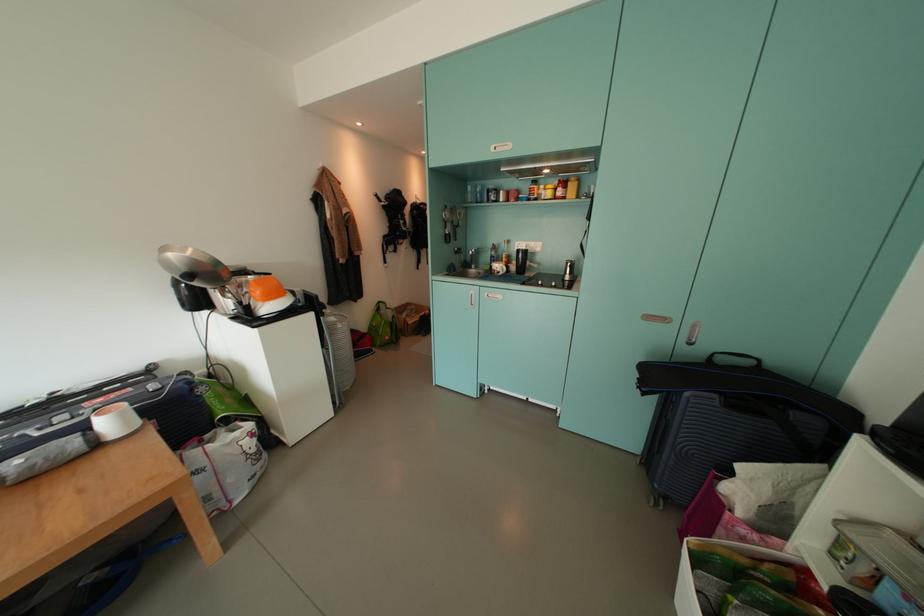
Image resolution: width=924 pixels, height=616 pixels. What do you see at coordinates (265, 292) in the screenshot?
I see `the orange appliance part` at bounding box center [265, 292].